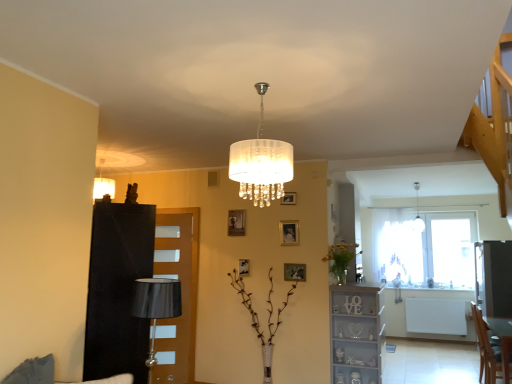
Question: Does black leather dresser at left have a smaller size compared to gold metallic picture frame at upper center, the first picture frame in the top-to-bottom sequence?

Choices:
 (A) yes
 (B) no

Answer: (B)

Question: From a real-world perspective, is black leather dresser at left physically below gold metallic picture frame at upper center, the first picture frame in the top-to-bottom sequence?

Choices:
 (A) yes
 (B) no

Answer: (A)

Question: Is black leather dresser at left at the left side of gold metallic picture frame at upper center, the 3th picture frame viewed from the right?

Choices:
 (A) no
 (B) yes

Answer: (B)

Question: From the image's perspective, is black leather dresser at left beneath gold metallic picture frame at upper center, the fifth picture frame in the bottom-to-top sequence?

Choices:
 (A) yes
 (B) no

Answer: (A)

Question: Is black leather dresser at left touching gold metallic picture frame at upper center, the 3th picture frame viewed from the right?

Choices:
 (A) no
 (B) yes

Answer: (A)

Question: Is black leather dresser at left oriented away from gold metallic picture frame at upper center, the 3th picture frame viewed from the right?

Choices:
 (A) no
 (B) yes

Answer: (A)

Question: From a real-world perspective, is wooden table at lower right positioned under brown wooden door at left based on gravity?

Choices:
 (A) no
 (B) yes

Answer: (B)

Question: Is wooden table at lower right turned away from brown wooden door at left?

Choices:
 (A) yes
 (B) no

Answer: (B)

Question: Can you confirm if wooden table at lower right is smaller than brown wooden door at left?

Choices:
 (A) yes
 (B) no

Answer: (B)

Question: Can you confirm if wooden table at lower right is taller than brown wooden door at left?

Choices:
 (A) no
 (B) yes

Answer: (A)

Question: From the image's perspective, is wooden table at lower right below brown wooden door at left?

Choices:
 (A) yes
 (B) no

Answer: (A)

Question: Is wooden table at lower right outside of brown wooden door at left?

Choices:
 (A) no
 (B) yes

Answer: (B)

Question: From the image's perspective, would you say black leather dresser at left is shown under gold metallic picture frame at center, acting as the 1th picture frame starting from the bottom?

Choices:
 (A) yes
 (B) no

Answer: (A)